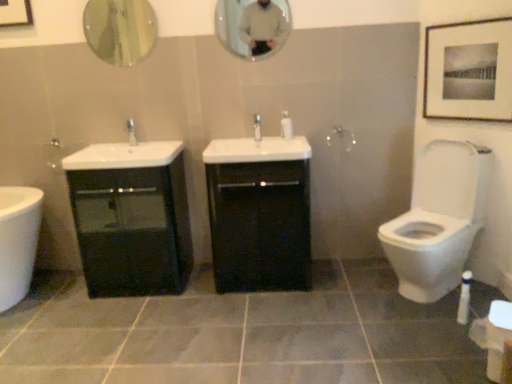
At what (x,y) coordinates should I click in order to perform the action: click on vacant area that is in front of white plastic toothbrush at lower right. Please return your answer as a coordinate pair (x, y). The width and height of the screenshot is (512, 384). Looking at the image, I should click on (458, 340).